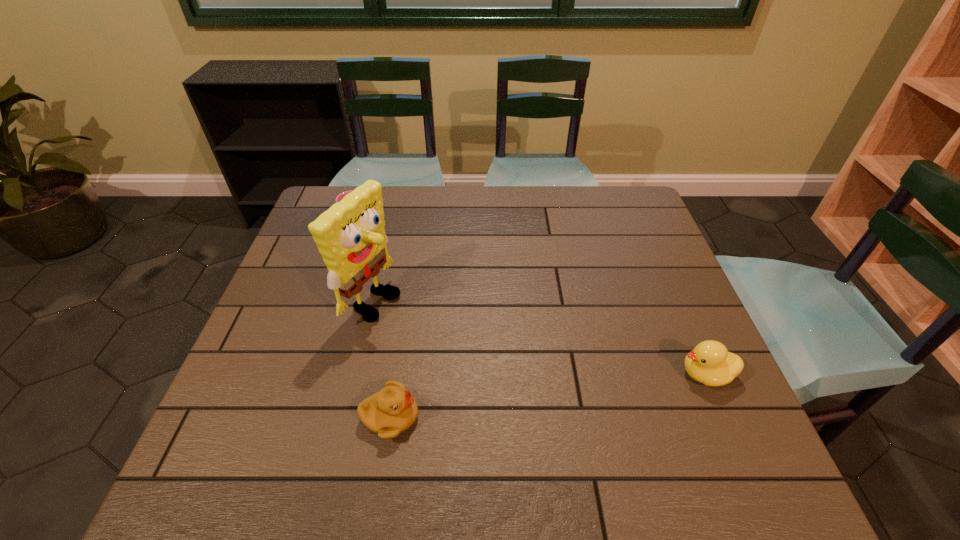
Locate an element on the screen. object present at the far left corner is located at coordinates (342, 195).

The width and height of the screenshot is (960, 540). Identify the location of free space at the far edge of the desktop. (576, 201).

Where is `vacant space at the near edge of the desktop`? The height and width of the screenshot is (540, 960). vacant space at the near edge of the desktop is located at coordinates (484, 406).

This screenshot has width=960, height=540. Find the location of `vacant space at the left edge of the desktop`. vacant space at the left edge of the desktop is located at coordinates (291, 371).

This screenshot has height=540, width=960. I want to click on vacant space at the right edge of the desktop, so click(x=647, y=235).

Image resolution: width=960 pixels, height=540 pixels. Find the location of `free space at the far right corner of the desktop`. free space at the far right corner of the desktop is located at coordinates (596, 210).

Find the location of a particular element. vacant point located between the third nearest object and the right duckling is located at coordinates (540, 338).

I want to click on empty location between the left duckling and the rightmost object, so click(x=548, y=396).

Image resolution: width=960 pixels, height=540 pixels. I want to click on free spot between the farthest object and the rightmost object, so click(530, 296).

Find the location of a particular element. The height and width of the screenshot is (540, 960). blank region between the rightmost object and the left duckling is located at coordinates (548, 396).